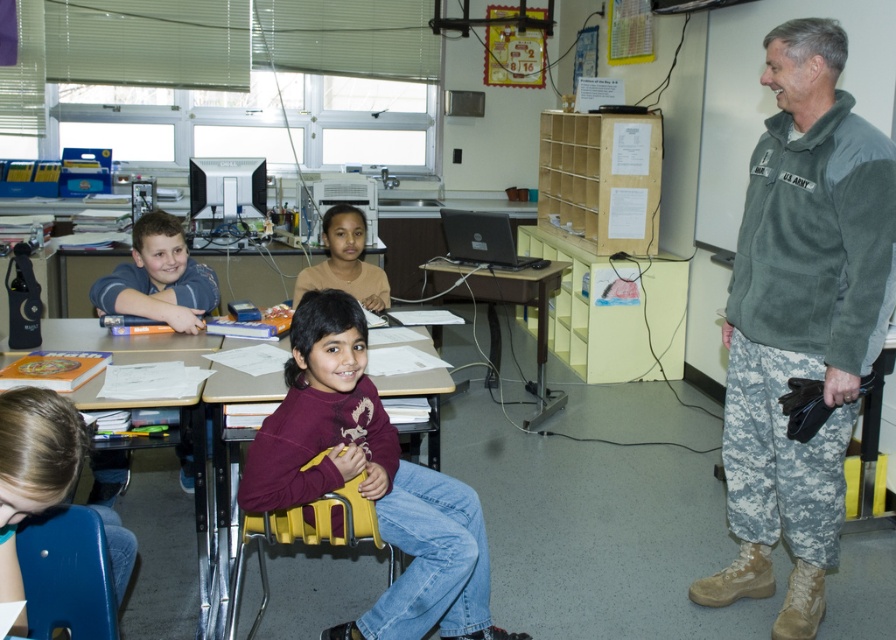
Between yellow plastic chair at center and brown wooden table at center, which one has less height?

yellow plastic chair at center

Who is more forward, (293, 538) or (521, 298)?

Point (293, 538) is more forward.

Where is `yellow plastic chair at center`? The width and height of the screenshot is (896, 640). yellow plastic chair at center is located at coordinates (307, 536).

Locate an element on the screen. Image resolution: width=896 pixels, height=640 pixels. blue denim jeans at left is located at coordinates (158, 276).

Does point (182, 284) come in front of point (166, 404)?

No, it is behind (166, 404).

The height and width of the screenshot is (640, 896). I want to click on blue denim jeans at left, so click(158, 276).

Is blue denim jeans at left wider than matte blue shirt at left?

No.

Who is more distant from viewer, (160, 221) or (183, 285)?

The point (183, 285) is behind.

Who is more distant from viewer, (145,212) or (152,212)?

The point (145,212) is behind.

Find the location of a particular element. This screenshot has width=896, height=640. blue denim jeans at left is located at coordinates (158, 276).